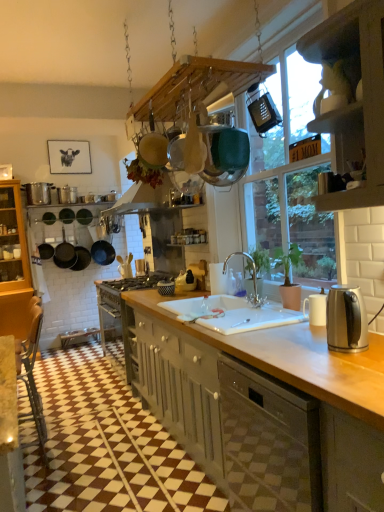
Question: Is the position of clear glass faucet at center less distant than that of matte gray cabinetry at center, which is the 1th cabinetry from back to front?

Choices:
 (A) no
 (B) yes

Answer: (A)

Question: Would you say clear glass faucet at center is a long distance from matte gray cabinetry at center, the second cabinetry from the front?

Choices:
 (A) yes
 (B) no

Answer: (B)

Question: From the image's perspective, is clear glass faucet at center below matte gray cabinetry at center, which is the 1th cabinetry from back to front?

Choices:
 (A) no
 (B) yes

Answer: (A)

Question: Is clear glass faucet at center smaller than matte gray cabinetry at center, arranged as the first cabinetry when ordered from the bottom?

Choices:
 (A) no
 (B) yes

Answer: (B)

Question: Is clear glass faucet at center turned away from matte gray cabinetry at center, arranged as the first cabinetry when ordered from the bottom?

Choices:
 (A) no
 (B) yes

Answer: (A)

Question: Is point (360, 66) positioned closer to the camera than point (304, 303)?

Choices:
 (A) farther
 (B) closer

Answer: (B)

Question: From a real-world perspective, relative to white ceramic mug at right, the 4th appliance when ordered from left to right, is white wood cabinet at upper right, which is the second cabinetry from back to front, vertically above or below?

Choices:
 (A) below
 (B) above

Answer: (B)

Question: Choose the correct answer: Is white wood cabinet at upper right, arranged as the first cabinetry when viewed from the front, inside white ceramic mug at right, marked as the 1th appliance in a bottom-to-top arrangement, or outside it?

Choices:
 (A) outside
 (B) inside

Answer: (A)

Question: In terms of width, does white wood cabinet at upper right, placed as the 1th cabinetry when sorted from top to bottom, look wider or thinner when compared to white ceramic mug at right, acting as the 4th appliance starting from the back?

Choices:
 (A) thin
 (B) wide

Answer: (B)

Question: From a real-world perspective, relative to matte silver toaster at center, which ranks as the 3th appliance in back-to-front order, is black paper picture frame at upper left vertically above or below?

Choices:
 (A) above
 (B) below

Answer: (A)

Question: Is black paper picture frame at upper left inside or outside of matte silver toaster at center, which is the 2th appliance from front to back?

Choices:
 (A) inside
 (B) outside

Answer: (B)

Question: Is black paper picture frame at upper left wider or thinner than matte silver toaster at center, which appears as the 2th appliance when viewed from the right?

Choices:
 (A) wide
 (B) thin

Answer: (A)

Question: Is black paper picture frame at upper left to the left or to the right of matte silver toaster at center, the 3th appliance ordered from the bottom, in the image?

Choices:
 (A) left
 (B) right

Answer: (A)

Question: Is point 66,172 closer or farther from the camera than point 342,403?

Choices:
 (A) farther
 (B) closer

Answer: (A)

Question: From their relative heights in the image, would you say black paper picture frame at upper left is taller or shorter than matte gray cabinetry at center, which appears as the second cabinetry when viewed from the top?

Choices:
 (A) tall
 (B) short

Answer: (B)